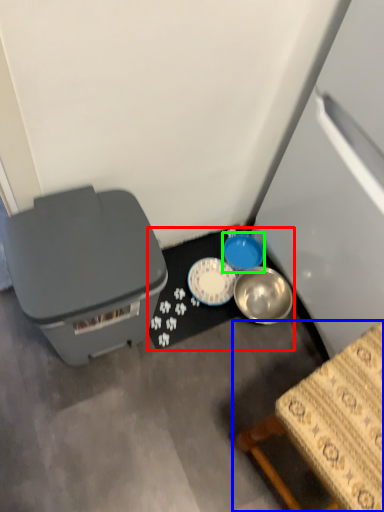
Question: Based on their relative distances, which object is farther from table (highlighted by a red box)? Choose from furniture (highlighted by a blue box) and bowl (highlighted by a green box).

Choices:
 (A) furniture
 (B) bowl

Answer: (A)